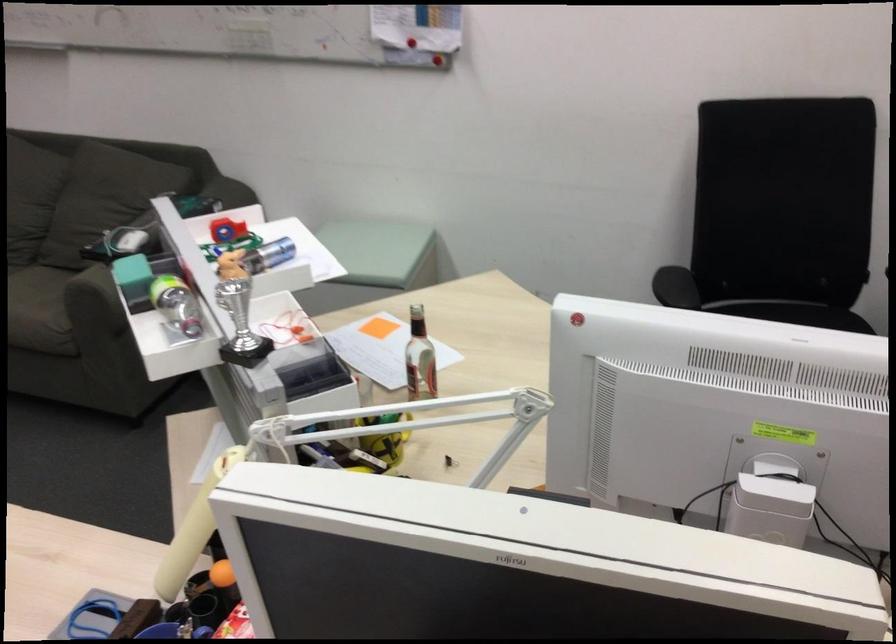
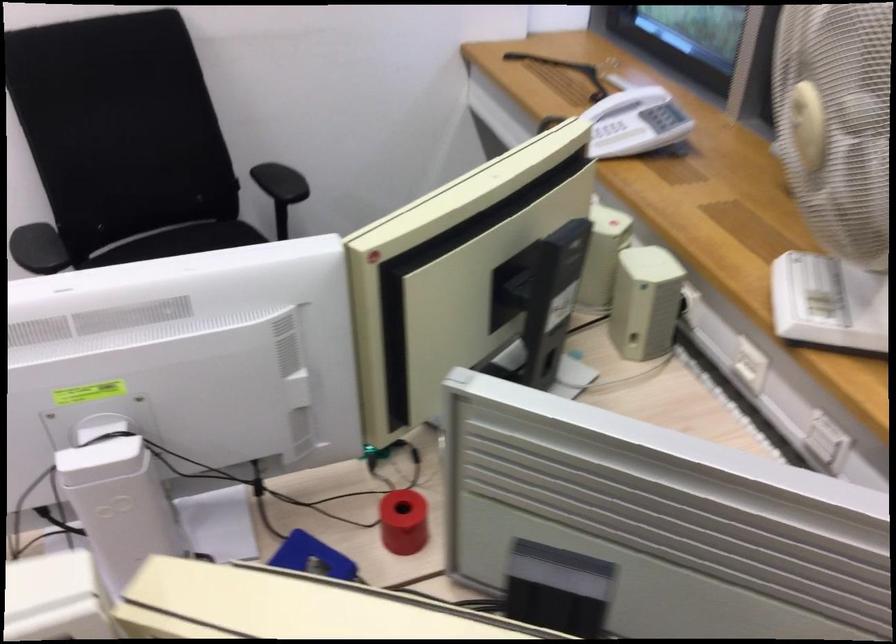
Find the pixel in the second image that matches the point at 757,527 in the first image.

(118, 500)